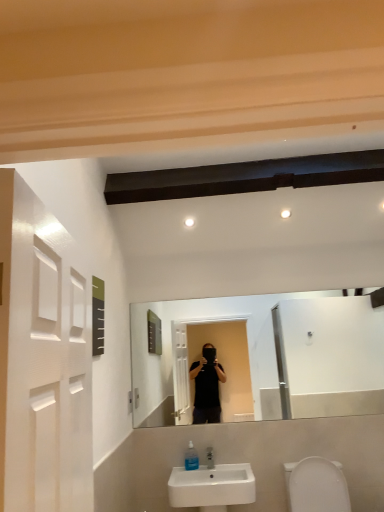
Question: From a real-world perspective, does white glossy toilet bowl at lower right sit lower than transparent plastic soap dispenser at lower center?

Choices:
 (A) yes
 (B) no

Answer: (A)

Question: Is white glossy toilet bowl at lower right turned away from transparent plastic soap dispenser at lower center?

Choices:
 (A) no
 (B) yes

Answer: (A)

Question: From a real-world perspective, is white glossy toilet bowl at lower right on transparent plastic soap dispenser at lower center?

Choices:
 (A) yes
 (B) no

Answer: (B)

Question: Could transparent plastic soap dispenser at lower center be considered to be inside white glossy toilet bowl at lower right?

Choices:
 (A) yes
 (B) no

Answer: (B)

Question: Is white glossy toilet bowl at lower right thinner than transparent plastic soap dispenser at lower center?

Choices:
 (A) yes
 (B) no

Answer: (B)

Question: Could you tell me if white glossy toilet bowl at lower right is facing transparent plastic soap dispenser at lower center?

Choices:
 (A) no
 (B) yes

Answer: (A)

Question: From the image's perspective, is transparent plastic soap dispenser at lower center above white glossy toilet bowl at lower right?

Choices:
 (A) yes
 (B) no

Answer: (A)

Question: Is the depth of transparent plastic soap dispenser at lower center less than that of white glossy toilet bowl at lower right?

Choices:
 (A) no
 (B) yes

Answer: (A)

Question: Considering the relative positions of transparent plastic soap dispenser at lower center and white glossy toilet bowl at lower right in the image provided, is transparent plastic soap dispenser at lower center to the left of white glossy toilet bowl at lower right from the viewer's perspective?

Choices:
 (A) yes
 (B) no

Answer: (A)

Question: Is transparent plastic soap dispenser at lower center facing away from white glossy toilet bowl at lower right?

Choices:
 (A) yes
 (B) no

Answer: (B)

Question: Considering the relative sizes of transparent plastic soap dispenser at lower center and white glossy toilet bowl at lower right in the image provided, is transparent plastic soap dispenser at lower center smaller than white glossy toilet bowl at lower right?

Choices:
 (A) no
 (B) yes

Answer: (B)

Question: Would you say transparent plastic soap dispenser at lower center contains white glossy toilet bowl at lower right?

Choices:
 (A) no
 (B) yes

Answer: (A)

Question: From the image's perspective, is white ceramic sink at lower center located beneath white glossy toilet bowl at lower right?

Choices:
 (A) yes
 (B) no

Answer: (A)